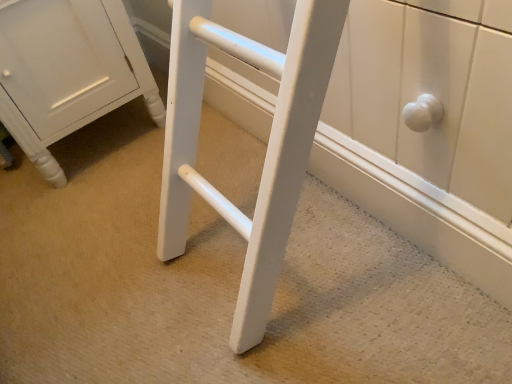
The height and width of the screenshot is (384, 512). Describe the element at coordinates (67, 72) in the screenshot. I see `white glossy cabinet at left` at that location.

Locate an element on the screen. The image size is (512, 384). white glossy cabinet at left is located at coordinates (67, 72).

Measure the distance between white glossy cabinet at left and camera.

A distance of 33.54 inches exists between white glossy cabinet at left and camera.

Image resolution: width=512 pixels, height=384 pixels. Identify the location of white glossy cabinet at left. (67, 72).